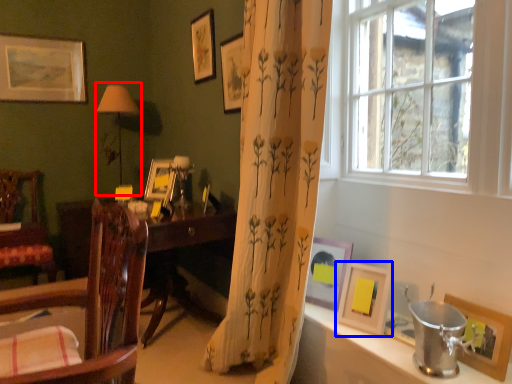
Question: Which point is further to the camera, table lamp (highlighted by a red box) or picture frame (highlighted by a blue box)?

Choices:
 (A) table lamp
 (B) picture frame

Answer: (A)